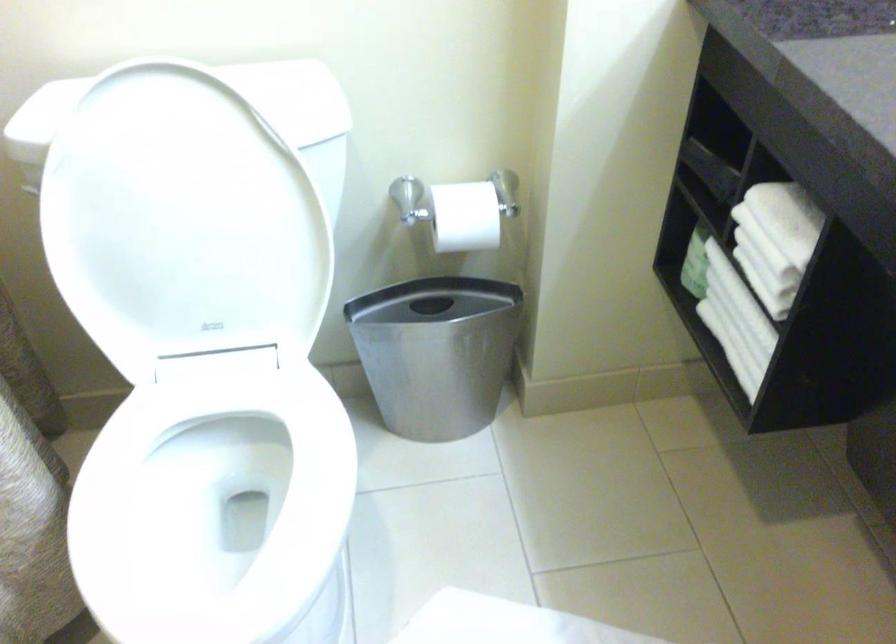
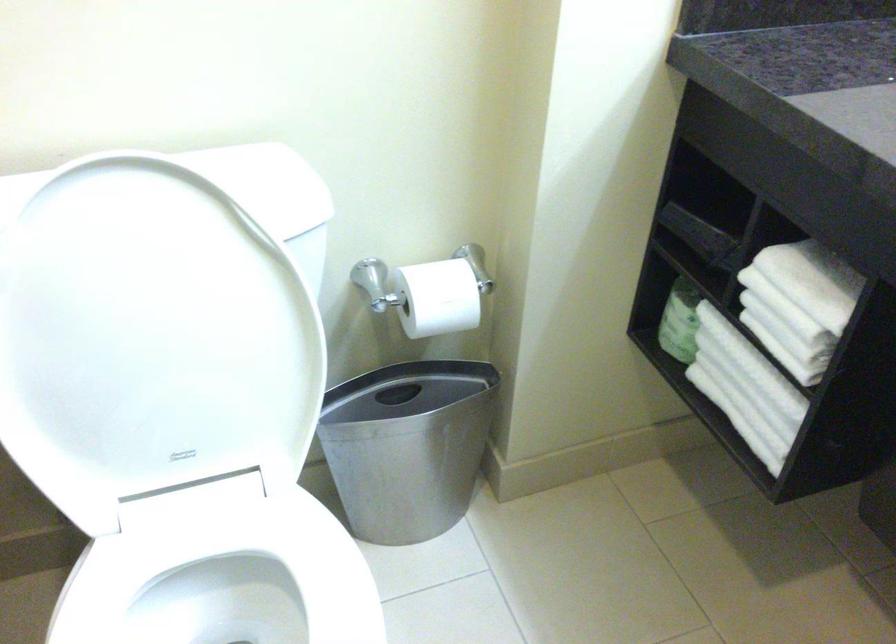
Find the pixel in the second image that matches (736,322) in the first image.

(745, 388)